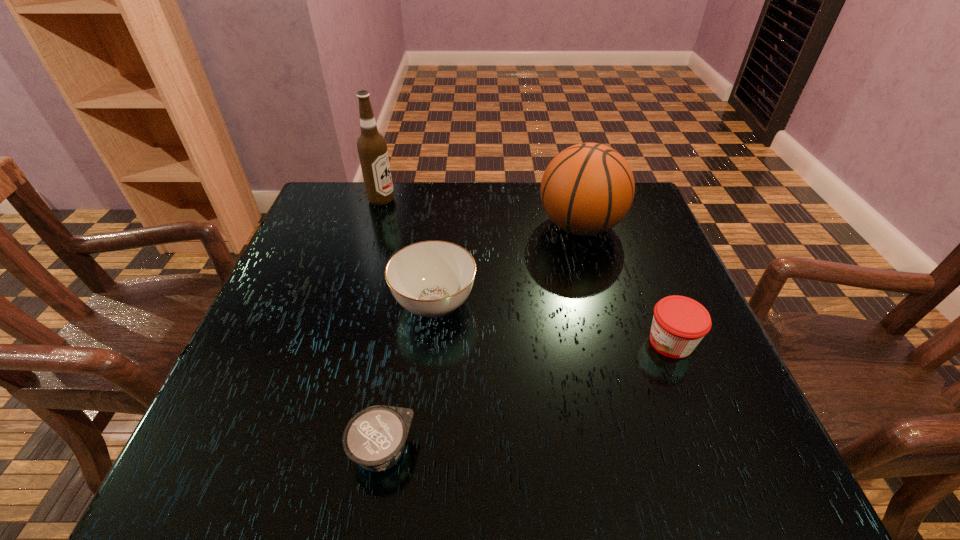
This screenshot has width=960, height=540. What are the coordinates of `object situated at the far left corner` in the screenshot? It's located at (372, 148).

Where is `object at the far right corner`? The width and height of the screenshot is (960, 540). object at the far right corner is located at coordinates (587, 189).

Find the location of `vacant region at the far edge of the desktop`. vacant region at the far edge of the desktop is located at coordinates (540, 212).

Where is `vacant space at the near edge of the desktop`? vacant space at the near edge of the desktop is located at coordinates (580, 436).

Identify the location of vacant space at the left edge. (299, 354).

Locate an element on the screen. free space at the right edge of the desktop is located at coordinates (657, 233).

Locate an element on the screen. This screenshot has width=960, height=540. vacant space at the far left corner is located at coordinates [x=369, y=213].

Identify the location of free space at the near left corner of the desktop. (253, 452).

In the image, there is a desktop. Identify the location of vacant space at the far right corner. (644, 218).

Identify the location of vacant space at the near right corner of the desktop. 776,465.